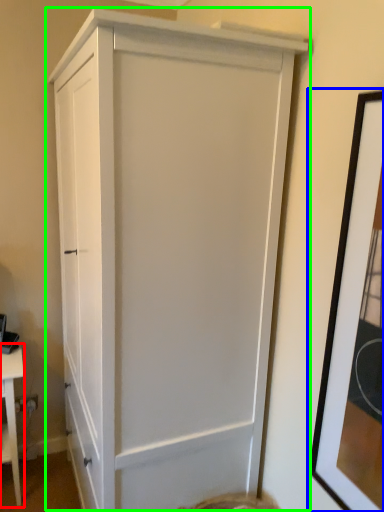
Question: Which is nearer to the table (highlighted by a red box)? picture frame (highlighted by a blue box) or cupboard (highlighted by a green box).

Choices:
 (A) picture frame
 (B) cupboard

Answer: (B)